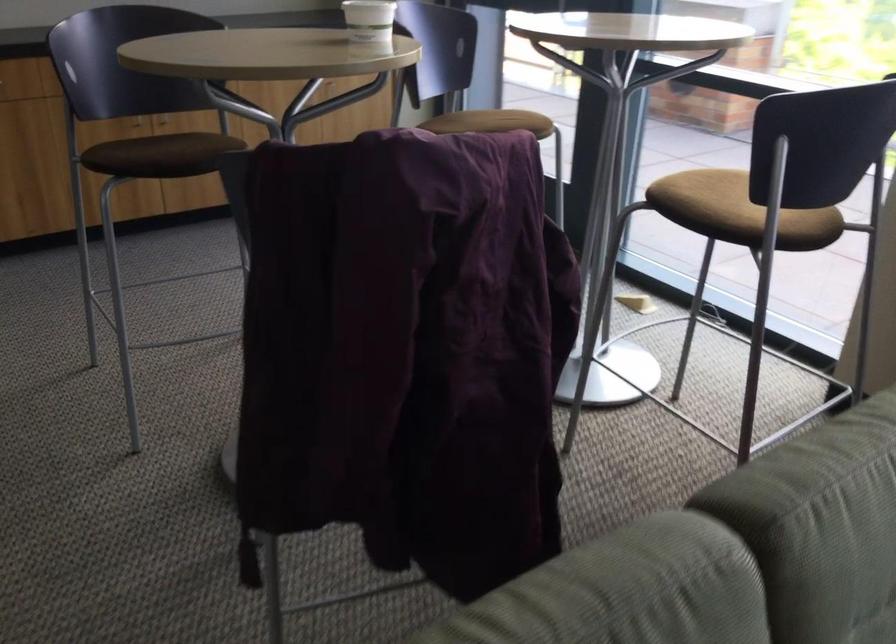
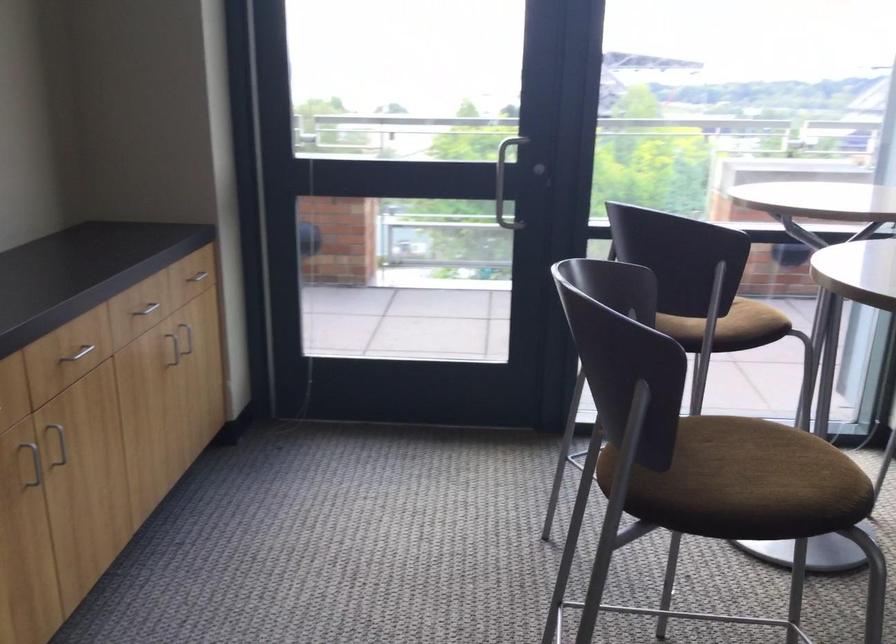
In the second image, find the point that corresponds to point 168,149 in the first image.

(739, 482)